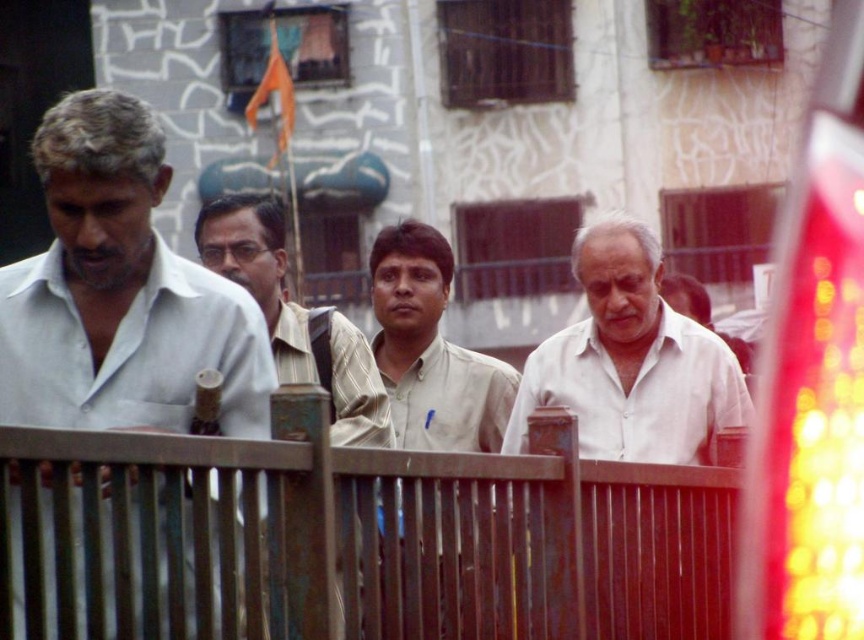
Question: Which object appears closest to the camera in this image?

Choices:
 (A) light brown shirt at center
 (B) striped fabric shirt at center
 (C) white matte shirt at center

Answer: (B)

Question: Does light brown shirt at center appear under striped fabric shirt at center?

Choices:
 (A) no
 (B) yes

Answer: (B)

Question: Which of the following is the closest to the observer?

Choices:
 (A) (577, 381)
 (B) (153, 364)
 (C) (471, 524)
 (D) (37, 436)

Answer: (D)

Question: Does white matte shirt at center have a larger size compared to striped fabric shirt at center?

Choices:
 (A) no
 (B) yes

Answer: (A)

Question: Where is rusty metal fence at center located in relation to light brown shirt at center in the image?

Choices:
 (A) left
 (B) right

Answer: (B)

Question: Which object is the farthest from the rusty metal fence at center?

Choices:
 (A) striped fabric shirt at center
 (B) white matte shirt at left
 (C) light brown shirt at center
 (D) white matte shirt at center

Answer: (D)